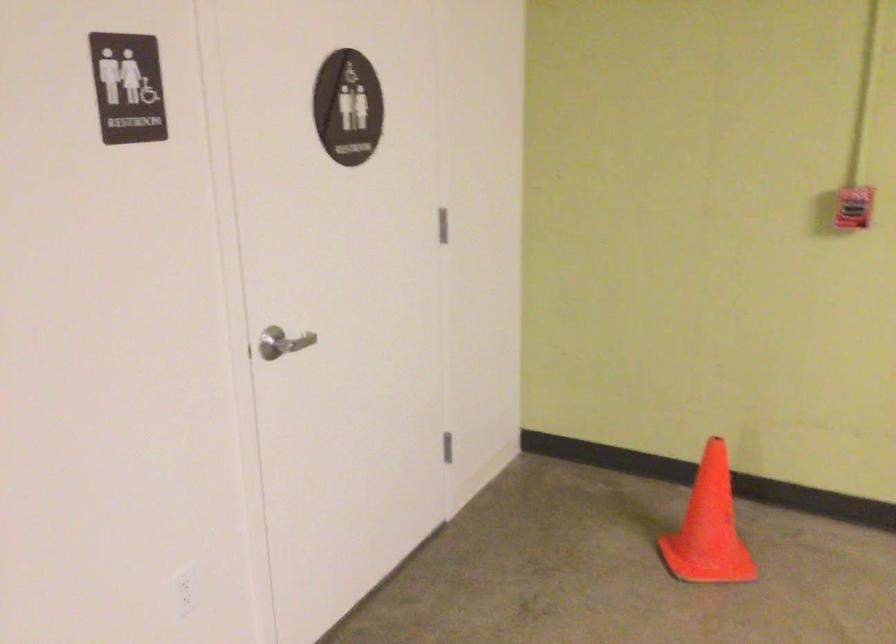
Describe the element at coordinates (854, 207) in the screenshot. The width and height of the screenshot is (896, 644). I see `a fire alarm handle` at that location.